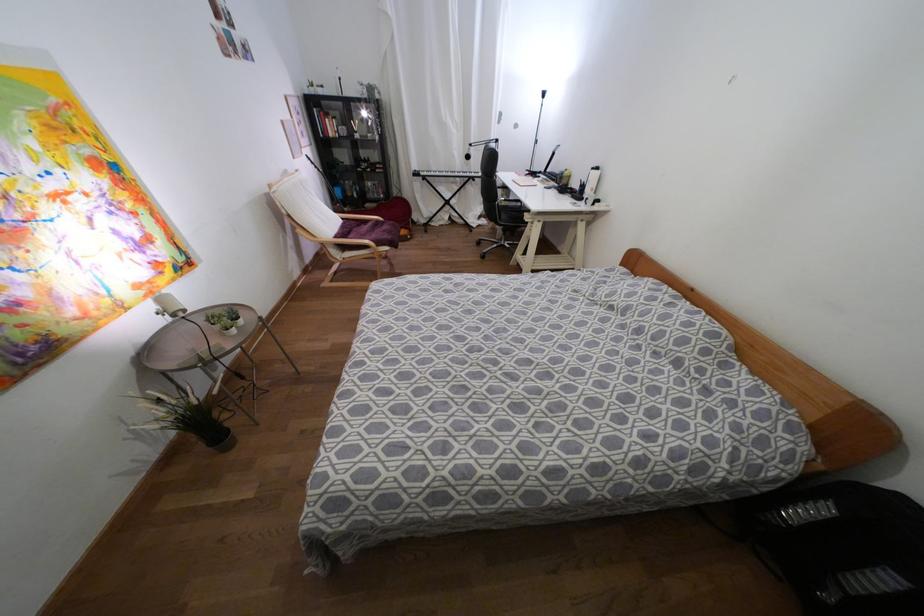
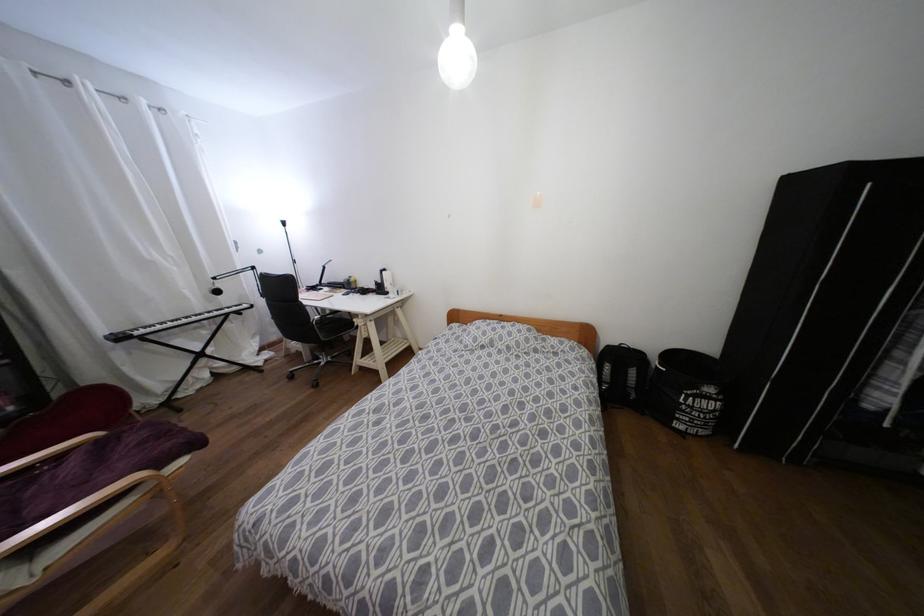
Question: The images are taken continuously from a first-person perspective. In which direction is your viewpoint rotating?

Choices:
 (A) Left
 (B) Right
 (C) Up
 (D) Down

Answer: (B)